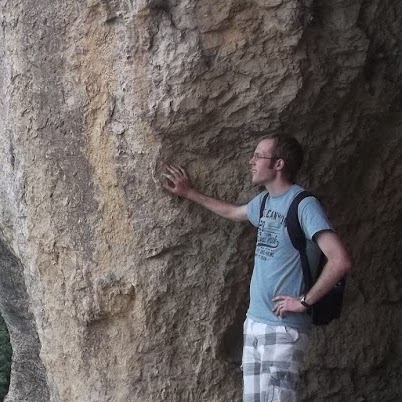
What are the coordinates of `brown glass frame` in the screenshot? It's located at (260, 158).